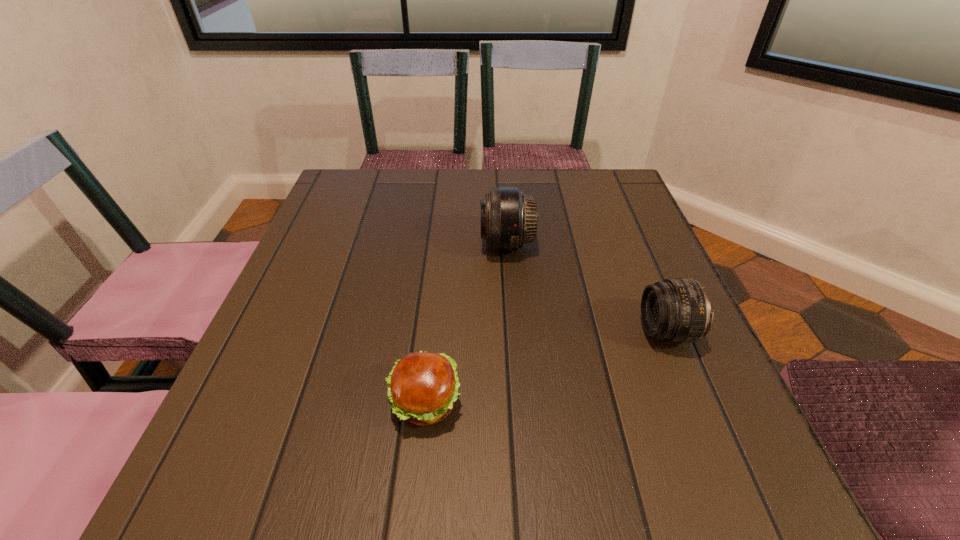
This screenshot has height=540, width=960. Identify the location of the farthest object. (508, 217).

Locate an element on the screen. The width and height of the screenshot is (960, 540). the left telephoto lens is located at coordinates (508, 217).

The image size is (960, 540). Identify the location of the second nearest object. (677, 310).

Where is `the nearer telephoto lens`? the nearer telephoto lens is located at coordinates (677, 310).

Where is `hamburger`? The height and width of the screenshot is (540, 960). hamburger is located at coordinates (422, 387).

Image resolution: width=960 pixels, height=540 pixels. I want to click on the nearest object, so click(422, 387).

Locate an element on the screen. vacant region located 0.260m on the front-facing side of the second object from left to right is located at coordinates (366, 245).

At what (x,y) coordinates should I click in order to perform the action: click on free space located on the front-facing side of the second object from left to right. Please return your answer as a coordinate pair (x, y). The image size is (960, 540). Looking at the image, I should click on (423, 245).

Find the location of a particular element. free spot located on the front-facing side of the second object from left to right is located at coordinates tap(428, 245).

Identify the location of vacant area situated 0.150m at the front element of the rightmost object. The width and height of the screenshot is (960, 540). (561, 332).